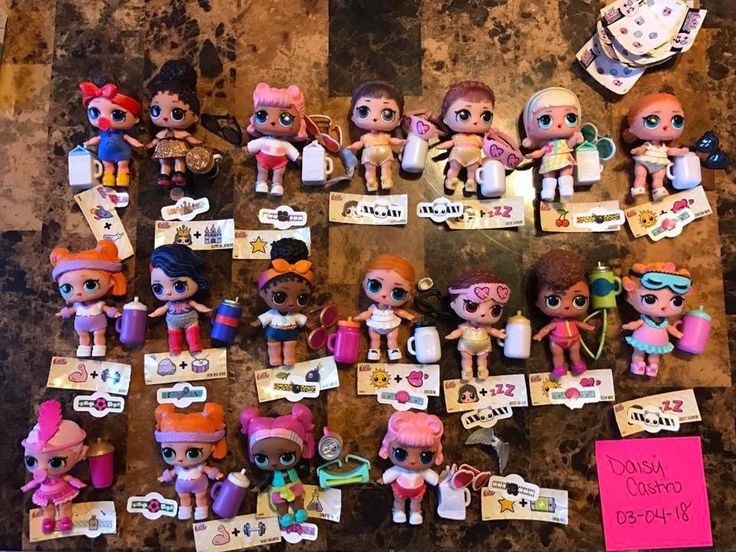
Image resolution: width=736 pixels, height=552 pixels. What are the coordinates of `dolls in top row` in the screenshot? It's located at (110, 147), (185, 145), (279, 132), (363, 132), (464, 132), (564, 124), (648, 132).